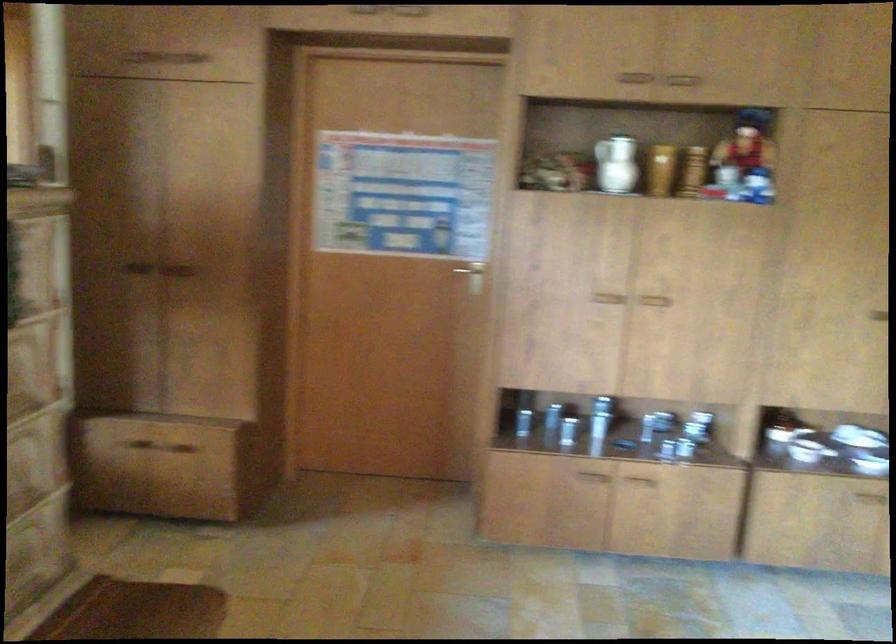
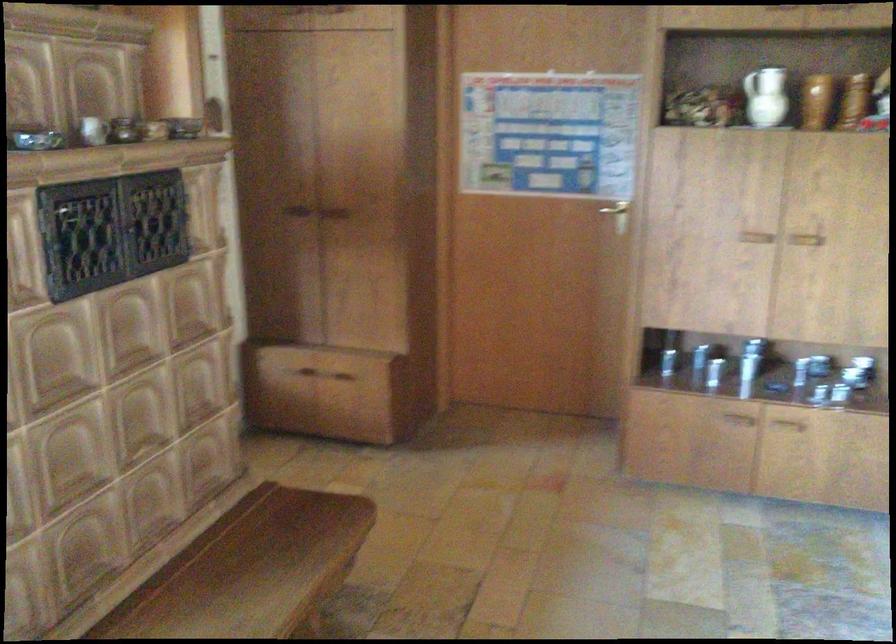
In the second image, find the point that corresponds to point 668,422 in the first image.

(820, 365)